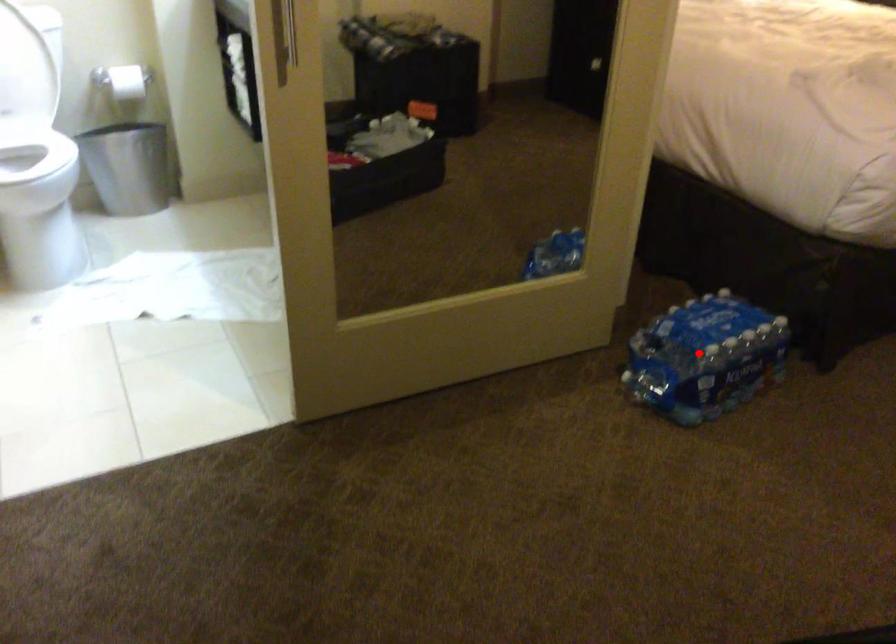
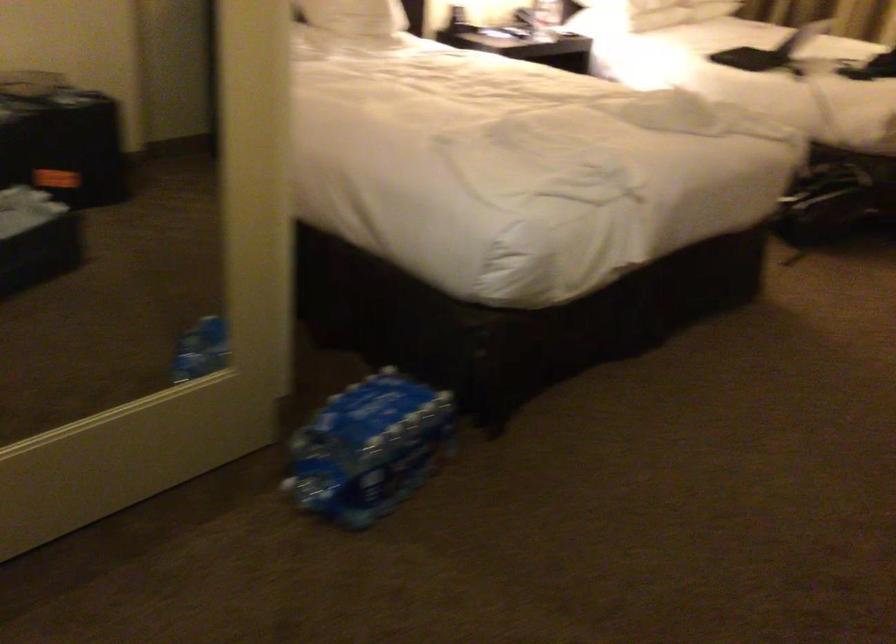
Question: I am providing you with two images of the same scene from different viewpoints. A red point is marked on the first image. At the location where the point appears in image 1, is it still visible in image 2?

Choices:
 (A) Yes
 (B) No

Answer: (A)